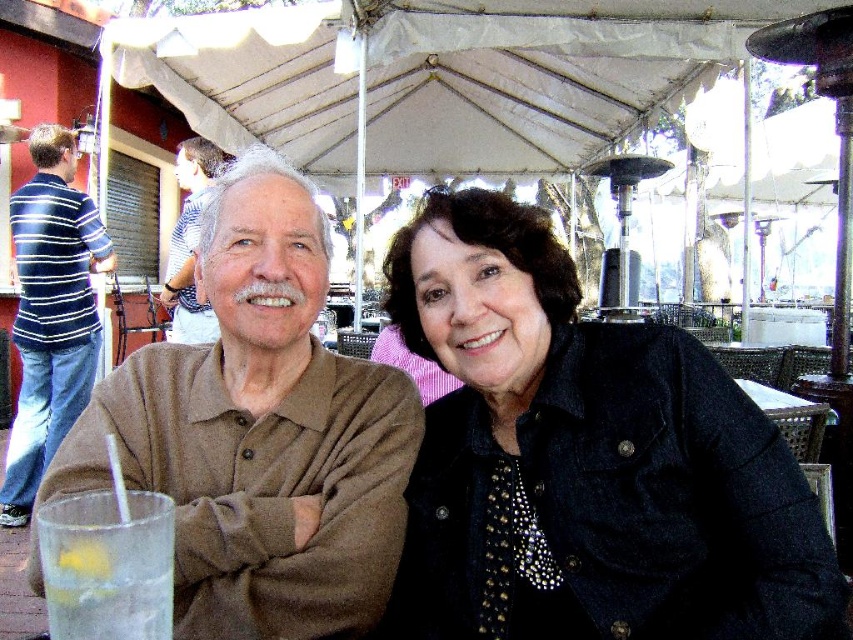
You are a photographer trying to capture both the brown cotton shirt at center and the striped cotton shirt at left in the same frame. Based on their heights, which shirt should you position closer to the camera to ensure both are fully visible?

The brown cotton shirt at center is shorter than the striped cotton shirt at left. To ensure both are fully visible, position the brown cotton shirt at center closer to the camera so its shorter height balances with the striped cotton shirt at left in the background.

You are standing at the center of the image and want to locate the brown cotton shirt at center. According to the coordinates provided, in which direction should you look to find it?

The brown cotton shirt at center is located at coordinates point [260,433]. Since you are at the center, looking towards the right side of the image would align with the x and y coordinates provided, so you should look to your right to find the brown cotton shirt at center.

You are a photographer trying to capture both the striped cotton shirt at left and the striped cotton shirt at upper left in a single frame. Which shirt should you focus on first to ensure both are in the frame?

The striped cotton shirt at left is smaller than the striped cotton shirt at upper left, so you should focus on the striped cotton shirt at upper left first to ensure both are in the frame.